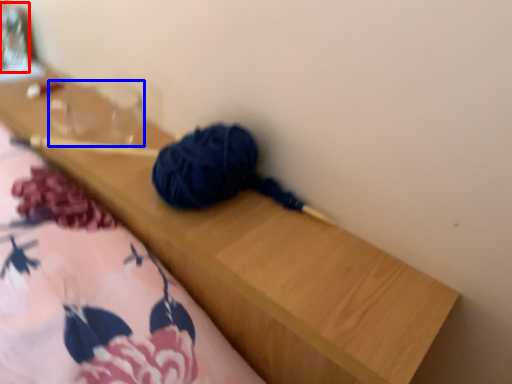
Question: Among these objects, which one is farthest to the camera, glass jar (highlighted by a red box) or clear (highlighted by a blue box)?

Choices:
 (A) glass jar
 (B) clear

Answer: (A)